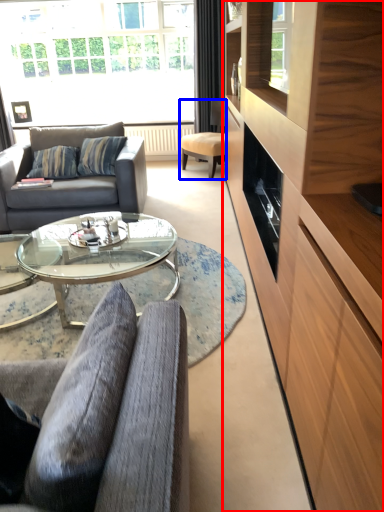
Question: Which of the following is the farthest to the observer, cabinetry (highlighted by a red box) or chair (highlighted by a blue box)?

Choices:
 (A) cabinetry
 (B) chair

Answer: (B)